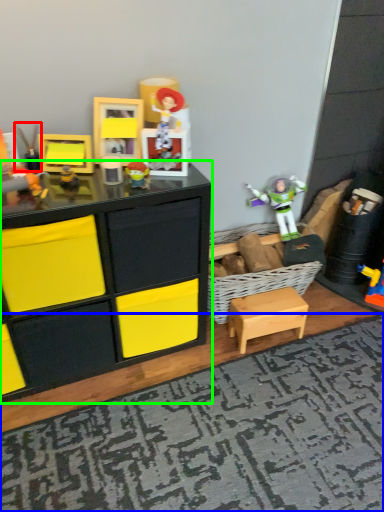
Question: Which object is positioned farthest from toy (highlighted by a red box)? Select from mat (highlighted by a blue box) and chest of drawers (highlighted by a green box).

Choices:
 (A) mat
 (B) chest of drawers

Answer: (A)